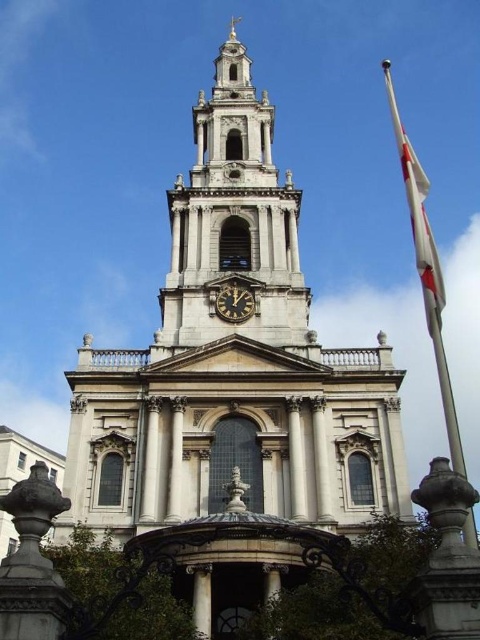
Does smooth stone clock tower at center have a lesser width compared to black polished clock at center?

Incorrect, smooth stone clock tower at center's width is not less than black polished clock at center's.

Is smooth stone clock tower at center smaller than black polished clock at center?

Actually, smooth stone clock tower at center might be larger than black polished clock at center.

Between point (178, 336) and point (235, 301), which one is positioned behind?

The point (235, 301) is behind.

This screenshot has width=480, height=640. I want to click on smooth stone clock tower at center, so click(233, 220).

The height and width of the screenshot is (640, 480). Describe the element at coordinates (418, 218) in the screenshot. I see `white fabric flag at upper right` at that location.

Locate an element on the screen. The height and width of the screenshot is (640, 480). white fabric flag at upper right is located at coordinates (418, 218).

Which is above, smooth stone clock tower at center or white fabric flag at upper right?

Positioned higher is smooth stone clock tower at center.

Between smooth stone clock tower at center and white fabric flag at upper right, which one appears on the left side from the viewer's perspective?

From the viewer's perspective, smooth stone clock tower at center appears more on the left side.

Which is behind, point (199, 221) or point (441, 285)?

Point (199, 221)

You are a GUI agent. You are given a task and a screenshot of the screen. Output one action in this format:
    pyautogui.click(x=<x>, y=<y>)
    Task: Click on the smooth stone clock tower at center
    Image resolution: width=480 pixels, height=640 pixels.
    Given the screenshot: What is the action you would take?
    pyautogui.click(x=233, y=220)